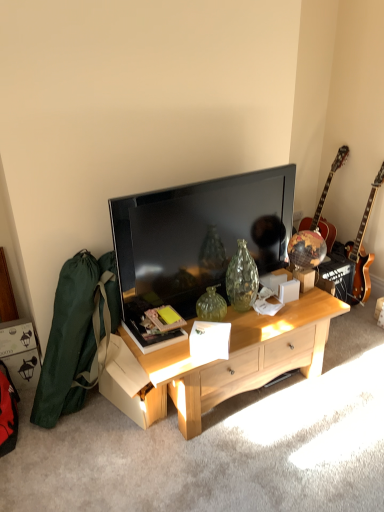
The width and height of the screenshot is (384, 512). Find the location of `free location in front of light wood cabinet at center`. free location in front of light wood cabinet at center is located at coordinates (251, 459).